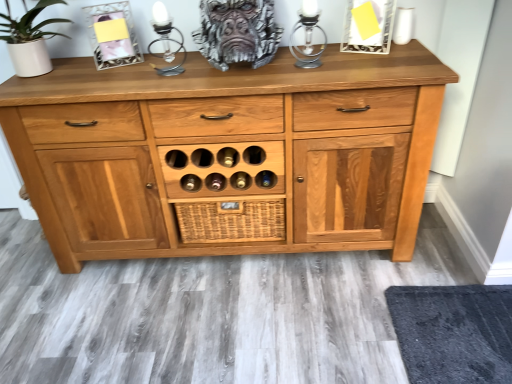
Identify the location of vacant space situated above woven brown basket at center (from a real-world perspective). The width and height of the screenshot is (512, 384). (231, 196).